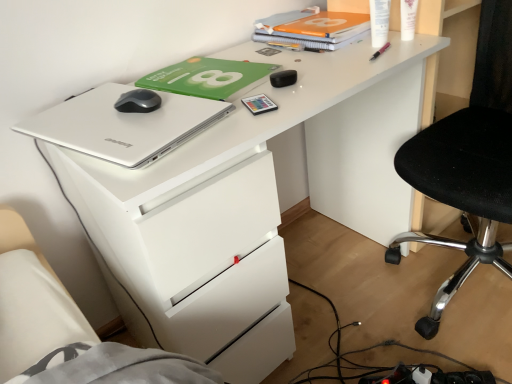
In order to click on vacant area that lies between matte plastic card at center, acting as the fifth stationery starting from the top, and white glossy lotion at upper right, which is the first stationery in top-to-bottom order in this screenshot , I will do `click(334, 72)`.